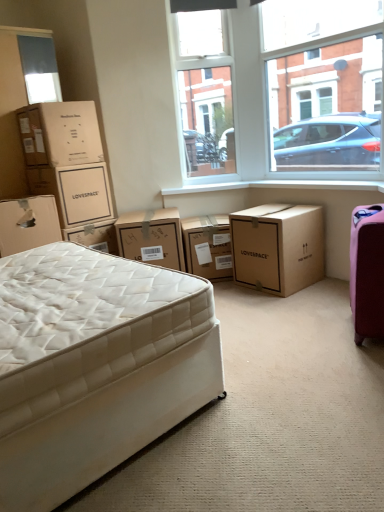
Image resolution: width=384 pixels, height=512 pixels. What are the coordinates of `vacant space in clear glass window at upper center (from a real-world perspective)` in the screenshot? It's located at (288, 178).